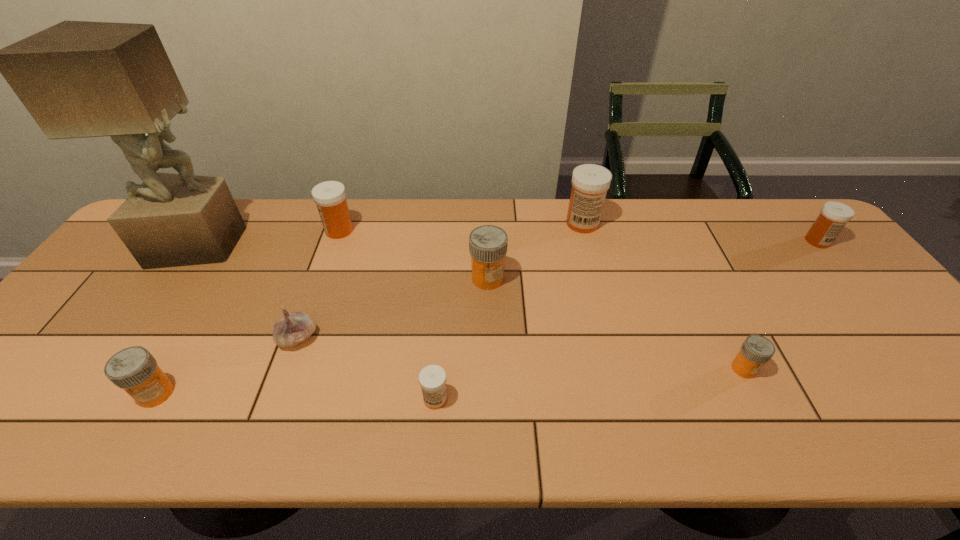
You are a GUI agent. You are given a task and a screenshot of the screen. Output one action in this format:
    pyautogui.click(x=<x>, y=<y>)
    Task: Click on the gray sculpture
    This screenshot has height=540, width=960.
    Given the screenshot: What is the action you would take?
    pyautogui.click(x=77, y=79)

Where is `sculpture`? The image size is (960, 540). sculpture is located at coordinates (77, 79).

Find the location of a particular element. Image resolution: width=960 pixels, height=540 pixels. the eighth shortest object is located at coordinates (590, 182).

Identify the location of the third medicine from right to left. (590, 182).

At what (x,y) coordinates should I click in order to perform the action: click on the leftmost white medicine. Please return your answer as a coordinate pair (x, y). Image resolution: width=960 pixels, height=540 pixels. Looking at the image, I should click on (330, 196).

The width and height of the screenshot is (960, 540). What are the coordinates of `the sixth medicine from right to left` in the screenshot? It's located at (330, 196).

Find the location of a particular element. the second orange medicine from right to left is located at coordinates (488, 244).

Locate an element on the screen. This screenshot has height=540, width=960. the sixth object from left to right is located at coordinates (488, 244).

At what (x,y) coordinates should I click in order to perform the action: click on the second smallest white medicine. Please return your answer as a coordinate pair (x, y). This screenshot has height=540, width=960. Looking at the image, I should click on (834, 215).

I want to click on the rightmost medicine, so click(x=834, y=215).